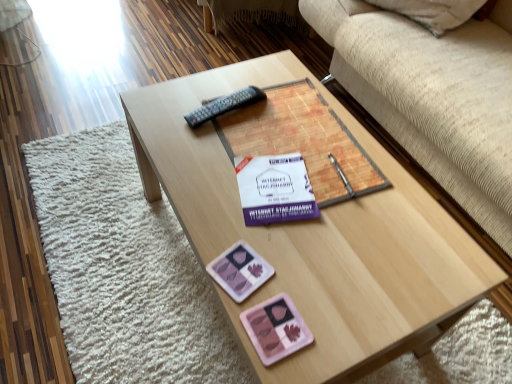
You are a GUI agent. You are given a task and a screenshot of the screen. Output one action in this format:
    pyautogui.click(x=<x>, y=<y>)
    Task: Click on the free area in between matte paper book at center and pink plastic at lower center, which is the second currency in bottom-to-top order
    The image size is (512, 384).
    Given the screenshot: What is the action you would take?
    pyautogui.click(x=257, y=219)